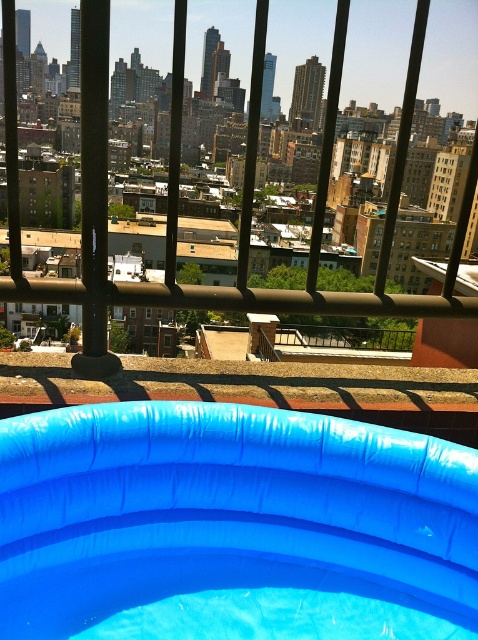
Can you confirm if blue rubber pool at center is taller than blue rubber pool at lower center?

No, blue rubber pool at center is not taller than blue rubber pool at lower center.

Can you confirm if blue rubber pool at center is bigger than blue rubber pool at lower center?

No.

Which is in front, point (30, 499) or point (469, 195)?

Point (30, 499) is in front.

The image size is (478, 640). In order to click on blue rubber pool at center in this screenshot , I will do `click(232, 525)`.